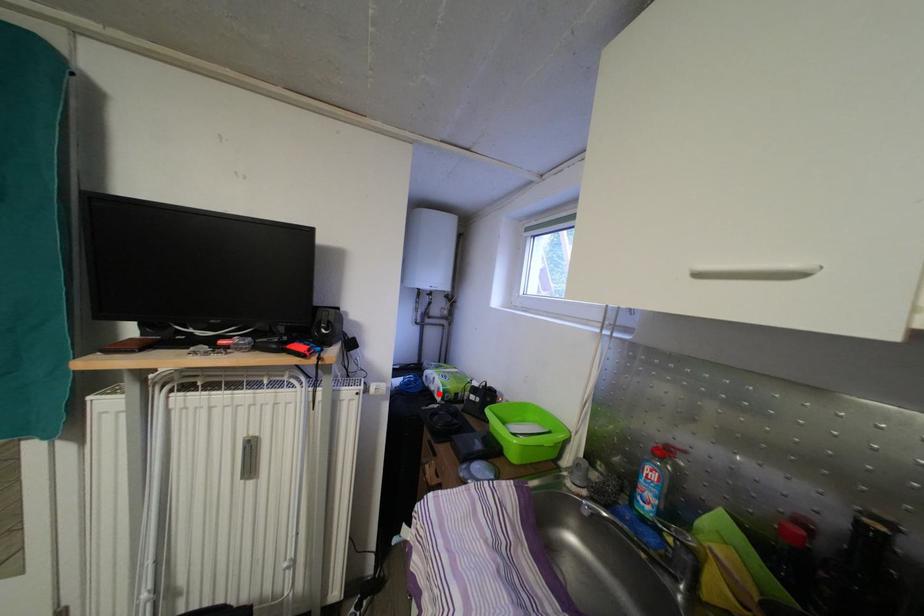
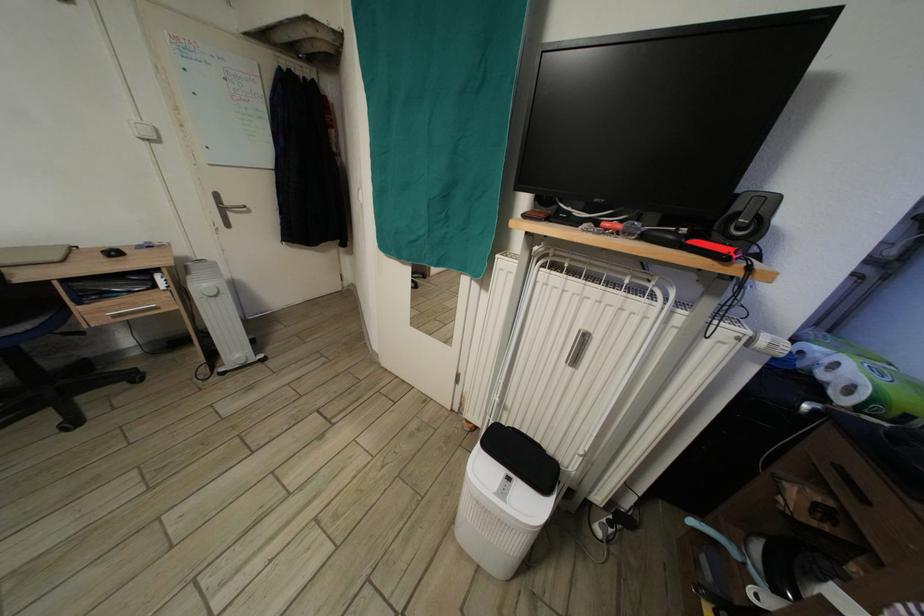
Locate, in the second image, the point that corresponds to the highlighted location in the first image.

(830, 383)